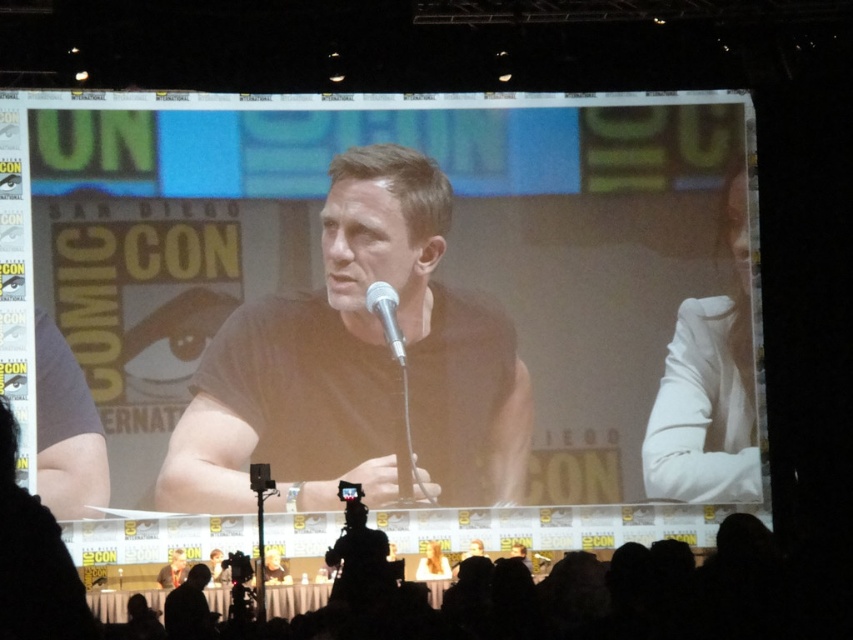
You are a photographer at the Comic Con panel and you see the black matte shirt at center and the silver metallic microphone at center. Which object is taller?

The black matte shirt at center is taller than the silver metallic microphone at center.

You are a photographer at the event and want to capture a photo of the black matte shirt at center from your current position at the back of the hall. Given that your camera has a maximum focus range of 80 meters, will you be able to take a clear photo?

The black matte shirt at center is 84.06 meters away from your current position, which exceeds the camera maximum focus range of 80 meters. Therefore, you will not be able to take a clear photo.